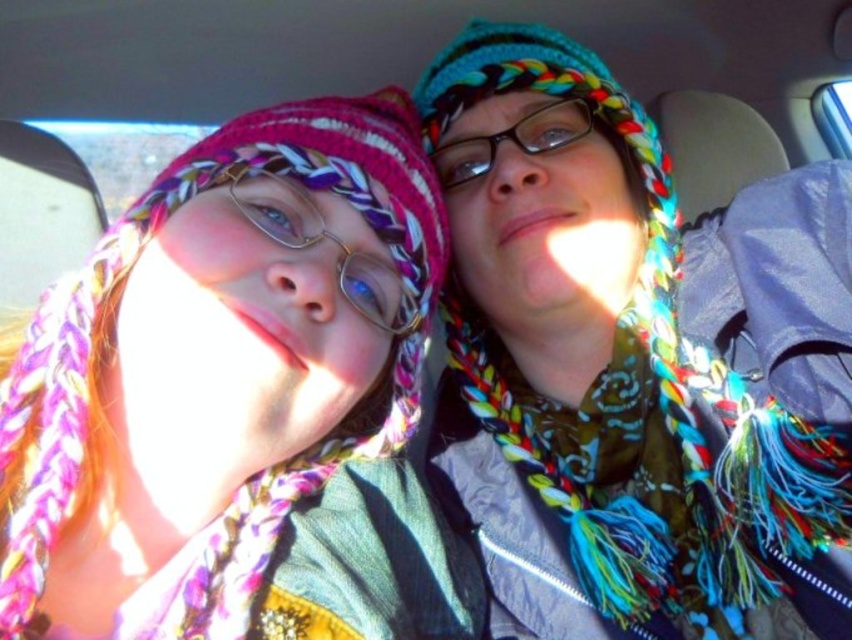
You are a photographer trying to capture the multicolored knitted hat at center in the center of your photo. Given that the photo has a coordinate system where the bottom left corner is at point 0.0 and the top right corner is at point 1.0, can you determine if the hat is already centered in the photo?

The multicolored knitted hat at center is located at point (634, 364). Since the center of the photo would be at point (426, 320), the hat is slightly to the right and above the center point. Therefore, it is not perfectly centered in the photo.

What are the coordinates of the multicolored knitted hat at center?

The multicolored knitted hat at center is located at coordinates point (634, 364).

You are a photographer trying to capture a closeup of the transparent plastic glasses at center without the matte pink scarf at left appearing in the frame. Given their sizes, is this possible?

The matte pink scarf at left is bigger than transparent plastic glasses at center, so it might block the view. To avoid the scarf, move the camera closer to the glasses or adjust the angle to frame only the glasses.